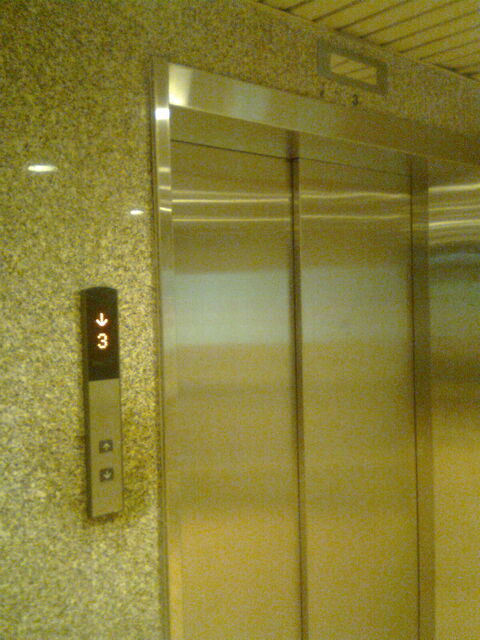
Locate an element on the screen. The image size is (480, 640). ceiling is located at coordinates (379, 17).